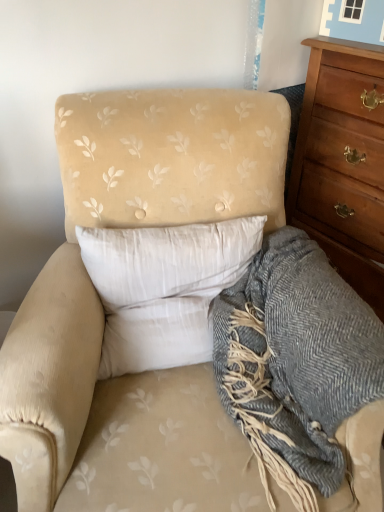
Question: From the image's perspective, is white soft pillow at center positioned above or below gray woolen blanket at lower right?

Choices:
 (A) above
 (B) below

Answer: (A)

Question: Is white soft pillow at center taller or shorter than gray woolen blanket at lower right?

Choices:
 (A) short
 (B) tall

Answer: (A)

Question: Which object is the farthest from the gray woolen blanket at lower right?

Choices:
 (A) wooden chest of drawers at right
 (B) white soft pillow at center

Answer: (A)

Question: Which is farther from the white soft pillow at center?

Choices:
 (A) wooden chest of drawers at right
 (B) gray woolen blanket at lower right

Answer: (A)